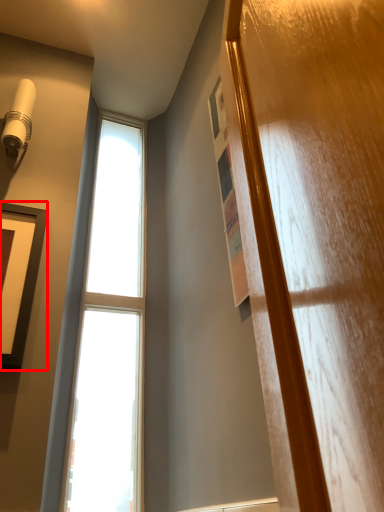
Question: Considering the relative positions of picture frame (annotated by the red box) and window in the image provided, where is picture frame (annotated by the red box) located with respect to the staircase?

Choices:
 (A) right
 (B) left

Answer: (B)